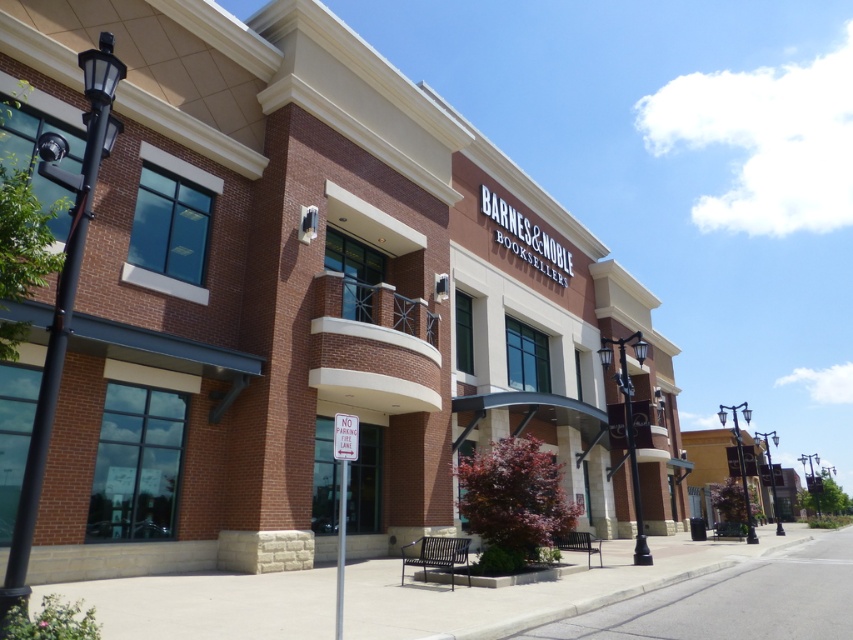
Question: Does gray concrete sidewalk at lower center appear on the right side of metallic pole at center?

Choices:
 (A) no
 (B) yes

Answer: (A)

Question: Which point is closer to the camera taking this photo?

Choices:
 (A) pos(640,504)
 (B) pos(47,426)

Answer: (B)

Question: Is black wrought iron streetlight at center positioned behind polished metal streetlight at center?

Choices:
 (A) yes
 (B) no

Answer: (B)

Question: Is black metal streetlight at left behind polished metal streetlight at center-right?

Choices:
 (A) yes
 (B) no

Answer: (B)

Question: Based on their relative distances, which object is farther from the gray concrete pavement at lower center?

Choices:
 (A) polished metal streetlight at center-right
 (B) black wrought iron streetlight at center
 (C) black metal streetlight at left
 (D) polished metal streetlight at center

Answer: (A)

Question: Among these objects, which one is nearest to the camera?

Choices:
 (A) black wrought iron streetlight at center
 (B) gray concrete sidewalk at lower center
 (C) polished metal streetlight at center
 (D) metallic pole at center

Answer: (B)